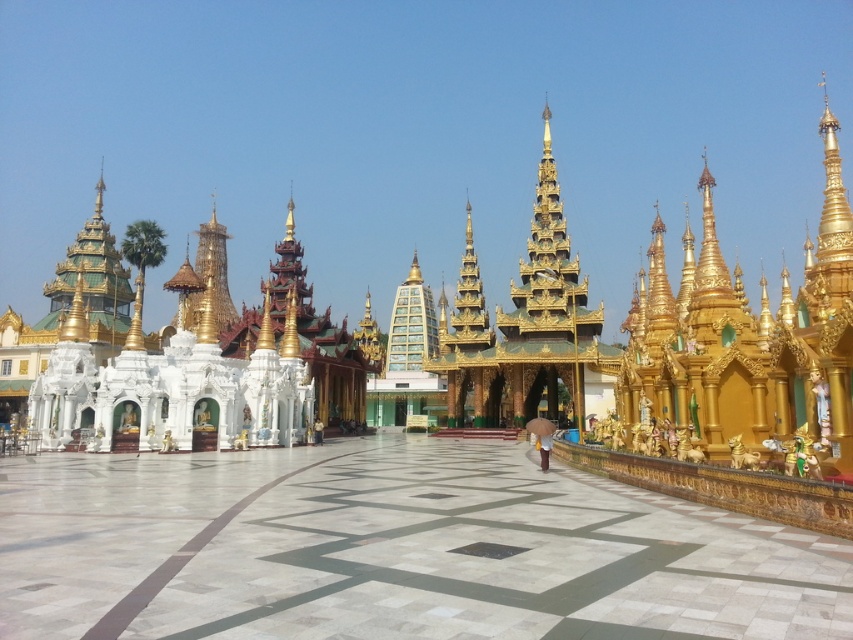
You are planning to place a new decorative statue in the temple complex. The statue requires a space that is wider than the brown fabric umbrella at center. Can the white marble plaza at center accommodate this statue?

The white marble plaza at center is wider than the brown fabric umbrella at center, so it can accommodate the statue as it requires a space wider than the umbrella.

You are a visitor standing at the entrance of the temple complex. You see the white marble plaza at center and the brown fabric umbrella at center. Which object is taller from your perspective?

The brown fabric umbrella at center is taller than the white marble plaza at center.

You are standing at the entrance of the temple complex and want to reach the brown fabric umbrella at center. Which direction should you walk from the white marble plaza at center to get there?

You should walk to the right from the white marble plaza at center to reach the brown fabric umbrella at center since the white marble plaza is to the left of the umbrella.